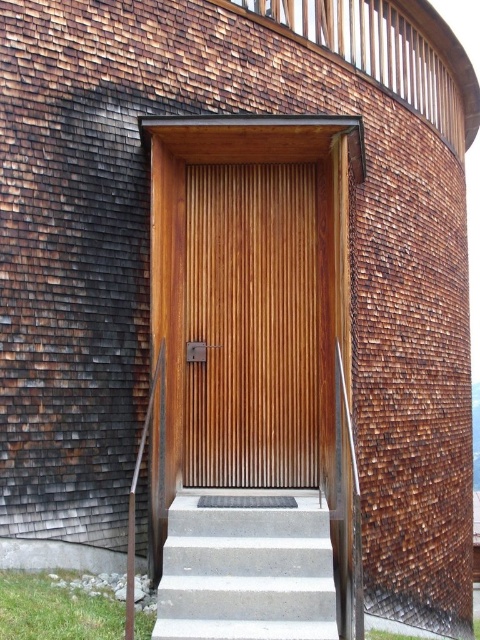
You are standing at the entrance of the architectural structure and want to know the exact position of the wooden slats at center. Can you determine their coordinates?

The wooden slats at center are located at point (x=251, y=326).

You are standing at the entrance of the modern architectural structure and want to reach the point marked as point (211, 570). Which direction should you move relative to point (133, 508)?

You should move forward from point (133, 508) to reach point (211, 570) since it is in front of it.

You are a delivery person approaching the entrance of the building. You need to place a package on the wooden slats at center and the wooden textured rail at left. Which surface can you place the package on without it falling off?

The wooden slats at center has a greater height compared to wooden textured rail at left, so placing the package on the wooden slats at center would be more stable and less likely to fall off.